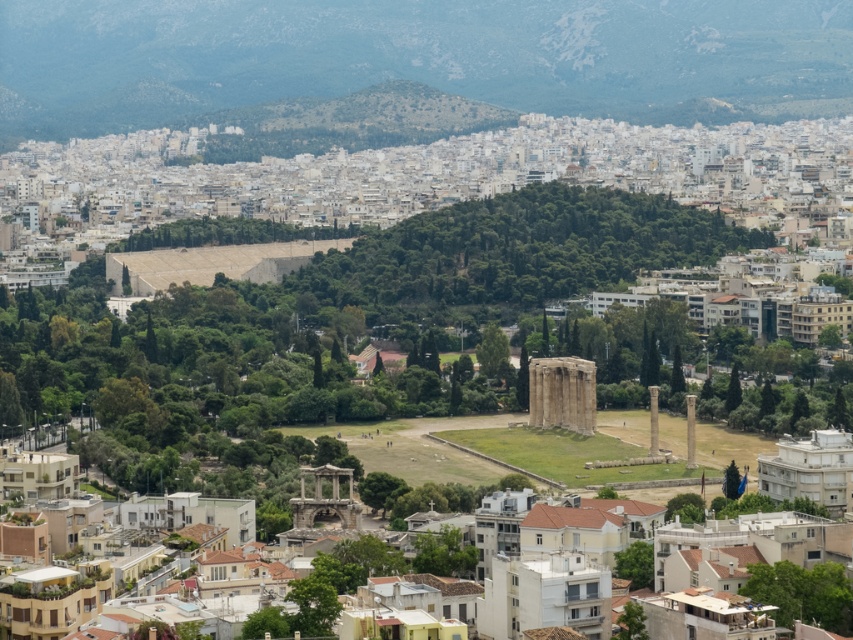
Is smooth stone column at center behind smooth stone pillar at center?

Yes, smooth stone column at center is further from the viewer.

Between point (654, 385) and point (688, 461), which one is positioned in front?

Point (688, 461) is in front.

I want to click on smooth stone column at center, so click(x=653, y=420).